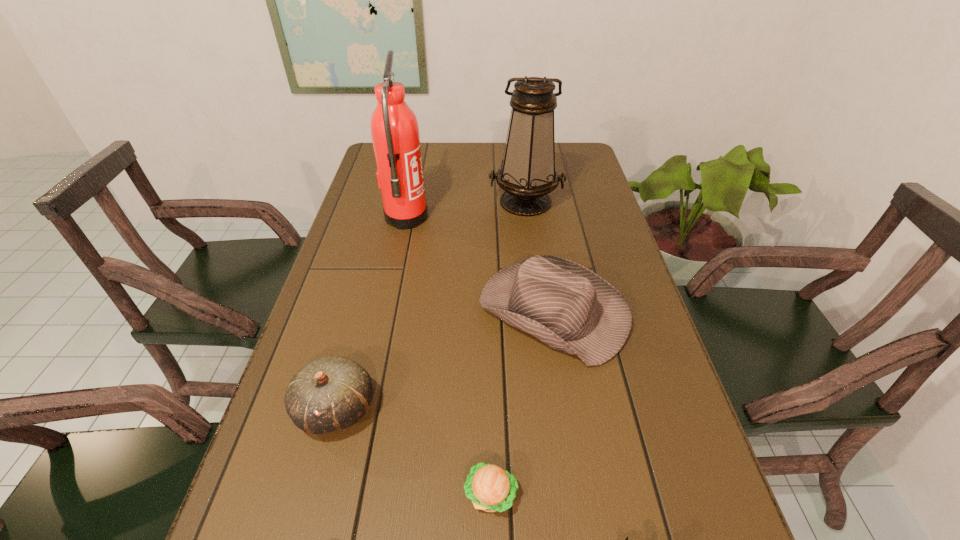
I want to click on vacant region between the third farthest object and the shortest object, so click(x=521, y=403).

The width and height of the screenshot is (960, 540). I want to click on free space that is in between the fifth shortest object and the fire extinguisher, so click(x=466, y=210).

At what (x,y) coordinates should I click in order to perform the action: click on free space between the fire extinguisher and the shortest object. Please return your answer as a coordinate pair (x, y). The height and width of the screenshot is (540, 960). Looking at the image, I should click on (448, 356).

Identify which object is located as the third nearest to the Lego. Please provide its 2D coordinates. Your answer should be formatted as a tuple, i.e. [(x, y)], where the tuple contains the x and y coordinates of a point satisfying the conditions above.

[(331, 393)]

Find the location of a particular element. This screenshot has height=540, width=960. object identified as the second closest to the oil lamp is located at coordinates (570, 308).

Locate an element on the screen. free space that satisfies the following two spatial constraints: 1. on the label side of the fourth nearest object; 2. on the right side of the fire extinguisher is located at coordinates (386, 311).

This screenshot has height=540, width=960. Find the location of `vacant position in the image that satisfies the following two spatial constraints: 1. on the label side of the fire extinguisher; 2. on the back side of the fedora`. vacant position in the image that satisfies the following two spatial constraints: 1. on the label side of the fire extinguisher; 2. on the back side of the fedora is located at coordinates click(x=386, y=311).

I want to click on free space in the image that satisfies the following two spatial constraints: 1. on the label side of the fire extinguisher; 2. on the back side of the shortest object, so click(x=348, y=494).

The height and width of the screenshot is (540, 960). I want to click on free space in the image that satisfies the following two spatial constraints: 1. on the label side of the fire extinguisher; 2. on the right side of the fedora, so click(x=386, y=311).

Identify the location of vacant point that satisfies the following two spatial constraints: 1. on the front side of the second tallest object; 2. on the label side of the fire extinguisher. (528, 218).